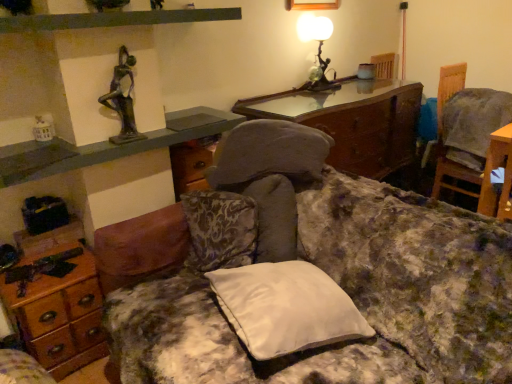
Question: From the image's perspective, does matte black shelf at upper left appear higher than fluffy fabric couch at center?

Choices:
 (A) no
 (B) yes

Answer: (B)

Question: Does matte black shelf at upper left appear on the right side of fluffy fabric couch at center?

Choices:
 (A) no
 (B) yes

Answer: (A)

Question: Can you confirm if matte black shelf at upper left is taller than fluffy fabric couch at center?

Choices:
 (A) no
 (B) yes

Answer: (A)

Question: Can you confirm if matte black shelf at upper left is bigger than fluffy fabric couch at center?

Choices:
 (A) no
 (B) yes

Answer: (A)

Question: From a real-world perspective, is matte black shelf at upper left on fluffy fabric couch at center?

Choices:
 (A) yes
 (B) no

Answer: (A)

Question: From a real-world perspective, is wooden desk at lower left physically located above or below white satin pillow at center?

Choices:
 (A) above
 (B) below

Answer: (B)

Question: Considering the positions of point (30, 311) and point (243, 306), is point (30, 311) closer or farther from the camera than point (243, 306)?

Choices:
 (A) farther
 (B) closer

Answer: (A)

Question: Considering the positions of wooden desk at lower left and white satin pillow at center in the image, is wooden desk at lower left taller or shorter than white satin pillow at center?

Choices:
 (A) tall
 (B) short

Answer: (A)

Question: Is wooden desk at lower left wider or thinner than white satin pillow at center?

Choices:
 (A) thin
 (B) wide

Answer: (A)

Question: In the image, is matte black shelf at upper left positioned in front of or behind wooden desk at lower left?

Choices:
 (A) front
 (B) behind

Answer: (A)

Question: Based on their positions, is matte black shelf at upper left located to the left or right of wooden desk at lower left?

Choices:
 (A) left
 (B) right

Answer: (B)

Question: Considering the positions of matte black shelf at upper left and wooden desk at lower left in the image, is matte black shelf at upper left wider or thinner than wooden desk at lower left?

Choices:
 (A) wide
 (B) thin

Answer: (A)

Question: From their relative heights in the image, would you say matte black shelf at upper left is taller or shorter than wooden desk at lower left?

Choices:
 (A) tall
 (B) short

Answer: (B)

Question: Relative to wooden chair at right, is black matte shelf at upper center in front or behind?

Choices:
 (A) behind
 (B) front

Answer: (B)

Question: Which is correct: black matte shelf at upper center is inside wooden chair at right, or outside of it?

Choices:
 (A) inside
 (B) outside

Answer: (B)